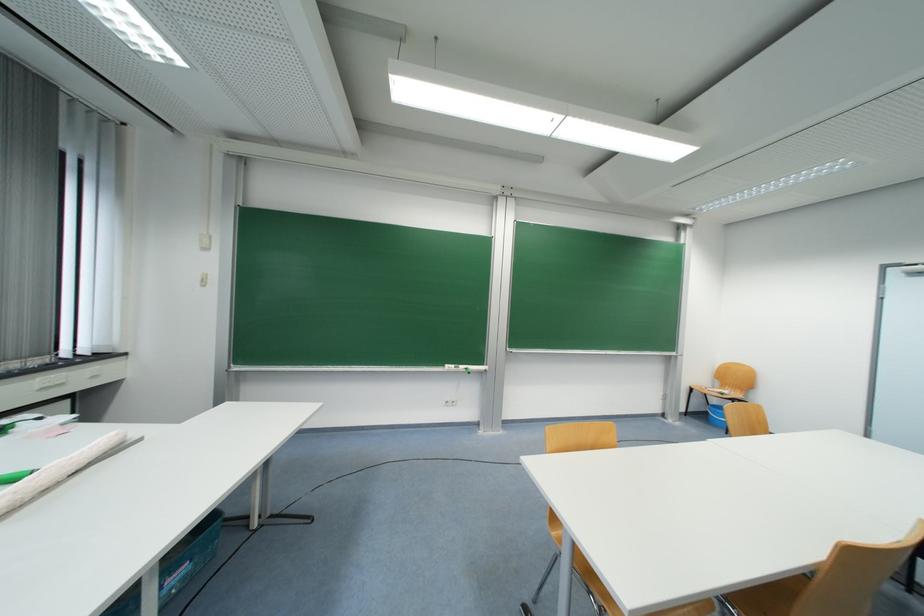
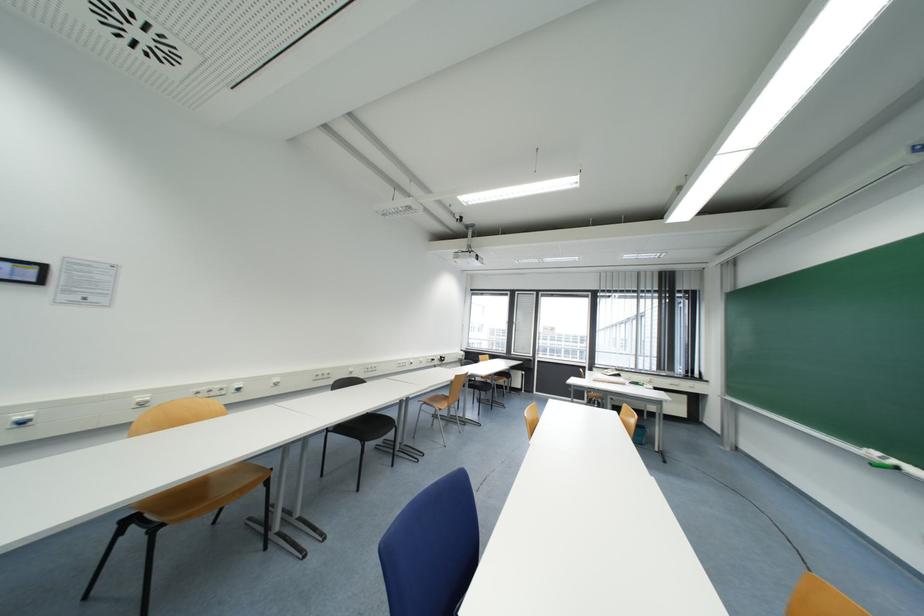
Find the pixel in the second image that matches the point at 505,190 in the first image.

(909, 154)